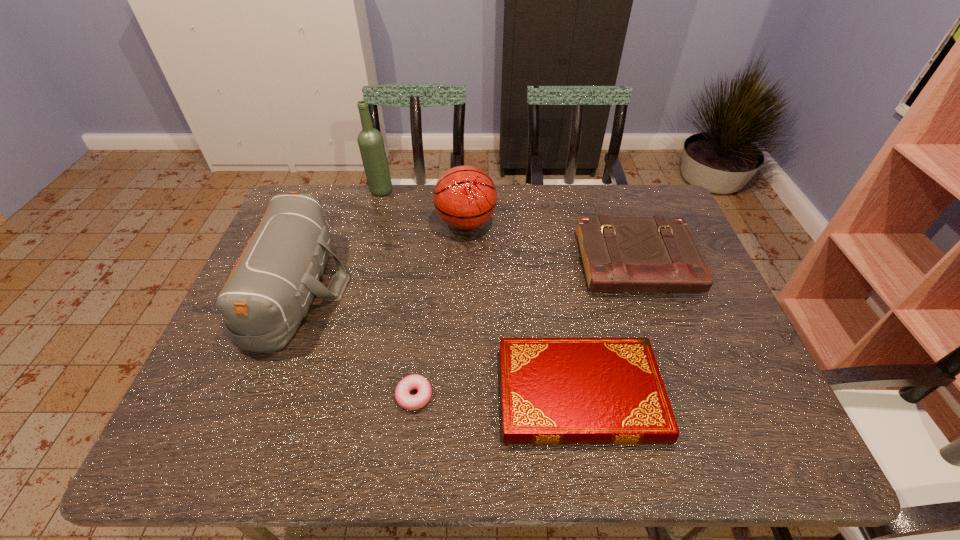
Identify the location of object that is at the left edge. (269, 291).

You are a GUI agent. You are given a task and a screenshot of the screen. Output one action in this format:
    pyautogui.click(x=<x>, y=<y>)
    Task: Click on the object positioned at the right edge
    
    Given the screenshot: What is the action you would take?
    pyautogui.click(x=619, y=254)

Identify the location of vacant space at the far edge of the desktop. The width and height of the screenshot is (960, 540). (361, 225).

Identify the location of vacant region at the near edge of the desktop. This screenshot has width=960, height=540. (537, 452).

In the image, there is a desktop. Where is `free region at the left edge`? free region at the left edge is located at coordinates (212, 390).

Where is `free space at the near left corner of the desktop`? This screenshot has width=960, height=540. free space at the near left corner of the desktop is located at coordinates (220, 428).

At what (x,y) coordinates should I click in order to perform the action: click on vacant region at the far right corner of the desktop. Please return your answer as a coordinate pair (x, y). Image resolution: width=960 pixels, height=540 pixels. Looking at the image, I should click on (653, 192).

The width and height of the screenshot is (960, 540). Find the location of `vacant space in between the tallest object and the nearer hardback book`. vacant space in between the tallest object and the nearer hardback book is located at coordinates (480, 293).

The image size is (960, 540). I want to click on empty space between the shorter hardback book and the basketball, so click(522, 308).

Where is `empty space between the tallest object and the duffel bag`? Image resolution: width=960 pixels, height=540 pixels. empty space between the tallest object and the duffel bag is located at coordinates (339, 239).